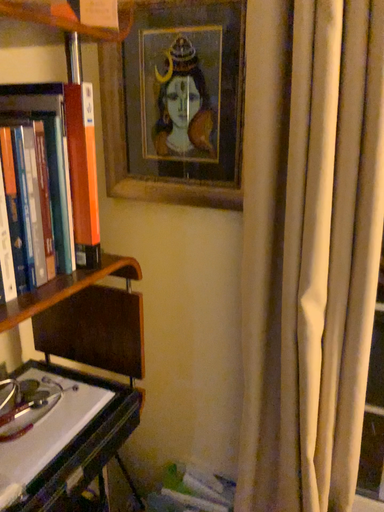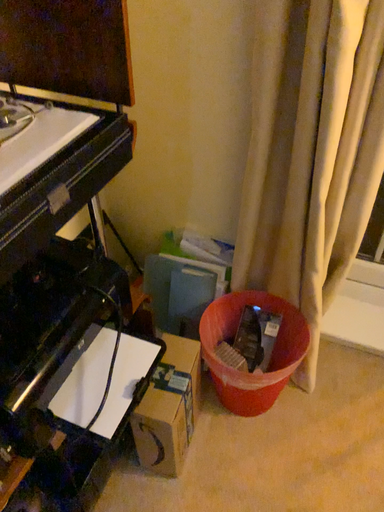
Question: How did the camera likely rotate when shooting the video?

Choices:
 (A) rotated upward
 (B) rotated downward

Answer: (B)